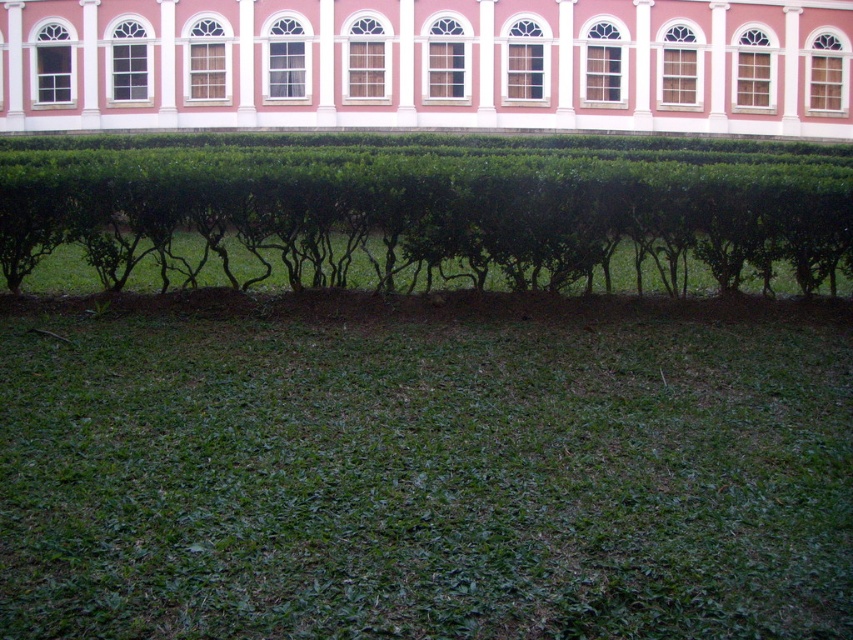
Question: Is green grass at lower center thinner than pink smooth wall at upper center?

Choices:
 (A) no
 (B) yes

Answer: (B)

Question: Which point is farther from the camera taking this photo?

Choices:
 (A) (689, 164)
 (B) (183, 612)

Answer: (A)

Question: Which point is farther to the camera?

Choices:
 (A) green leafy bush at center
 (B) pink smooth wall at upper center
 (C) green grass at lower center

Answer: (B)

Question: Which of the following is the farthest from the observer?

Choices:
 (A) (759, 236)
 (B) (268, 508)

Answer: (A)

Question: Is green grass at lower center wider than pink smooth wall at upper center?

Choices:
 (A) no
 (B) yes

Answer: (A)

Question: Can you confirm if green grass at lower center is positioned below pink smooth wall at upper center?

Choices:
 (A) yes
 (B) no

Answer: (A)